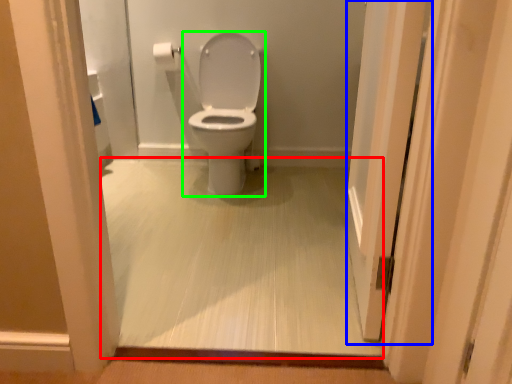
Question: Estimate the real-world distances between objects in this image. Which object is closer to corridor (highlighted by a red box), screen door (highlighted by a blue box) or toilet (highlighted by a green box)?

Choices:
 (A) screen door
 (B) toilet

Answer: (A)